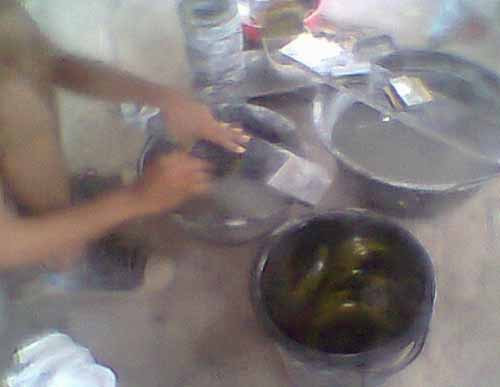
This screenshot has height=387, width=500. Find the location of `bucket`. bucket is located at coordinates (388, 358).